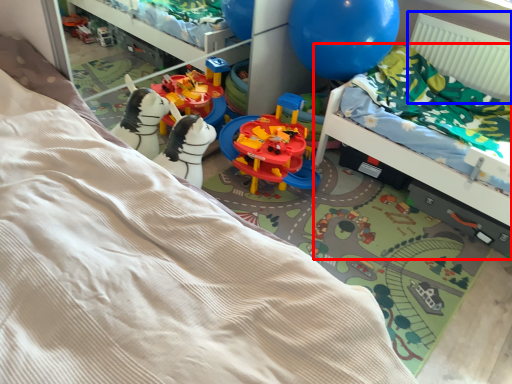
Question: Which of the following is the farthest to the observer, hospital bed (highlighted by a red box) or radiator (highlighted by a blue box)?

Choices:
 (A) hospital bed
 (B) radiator

Answer: (B)